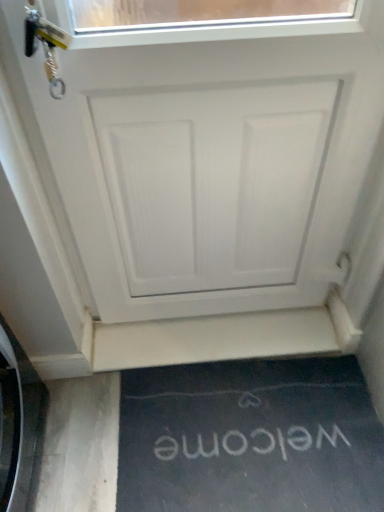
Question: Does black rubber doormat at lower center have a larger size compared to white matte stairwell at lower center?

Choices:
 (A) no
 (B) yes

Answer: (B)

Question: From the image's perspective, would you say black rubber doormat at lower center is shown under white matte stairwell at lower center?

Choices:
 (A) yes
 (B) no

Answer: (A)

Question: Considering the relative sizes of black rubber doormat at lower center and white matte stairwell at lower center in the image provided, is black rubber doormat at lower center thinner than white matte stairwell at lower center?

Choices:
 (A) yes
 (B) no

Answer: (B)

Question: Is black rubber doormat at lower center shorter than white matte stairwell at lower center?

Choices:
 (A) yes
 (B) no

Answer: (B)

Question: Is black rubber doormat at lower center closer to camera compared to white matte stairwell at lower center?

Choices:
 (A) yes
 (B) no

Answer: (A)

Question: Does black rubber doormat at lower center have a smaller size compared to white matte stairwell at lower center?

Choices:
 (A) no
 (B) yes

Answer: (A)

Question: Considering the relative sizes of white matte stairwell at lower center and black rubber doormat at lower center in the image provided, is white matte stairwell at lower center wider than black rubber doormat at lower center?

Choices:
 (A) no
 (B) yes

Answer: (A)

Question: From the image's perspective, is white matte stairwell at lower center located beneath black rubber doormat at lower center?

Choices:
 (A) no
 (B) yes

Answer: (A)

Question: Is white matte stairwell at lower center far away from black rubber doormat at lower center?

Choices:
 (A) yes
 (B) no

Answer: (B)

Question: Does white matte stairwell at lower center have a larger size compared to black rubber doormat at lower center?

Choices:
 (A) no
 (B) yes

Answer: (A)

Question: Is white matte stairwell at lower center taller than black rubber doormat at lower center?

Choices:
 (A) yes
 (B) no

Answer: (B)

Question: Does white matte stairwell at lower center have a lesser height compared to black rubber doormat at lower center?

Choices:
 (A) yes
 (B) no

Answer: (A)

Question: From a real-world perspective, is white matte door at center over black rubber doormat at lower center?

Choices:
 (A) no
 (B) yes

Answer: (B)